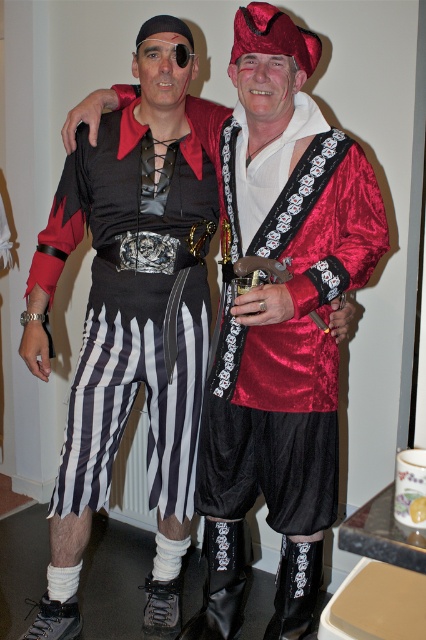
Is shiny red fabric vest at center shorter than black striped skirt at left?

Correct, shiny red fabric vest at center is not as tall as black striped skirt at left.

Who is positioned more to the left, shiny red fabric vest at center or black striped skirt at left?

black striped skirt at left

Which is behind, point (331, 449) or point (230, 109)?

Point (230, 109)

This screenshot has height=640, width=426. In order to click on shiny red fabric vest at center in this screenshot , I will do `click(291, 346)`.